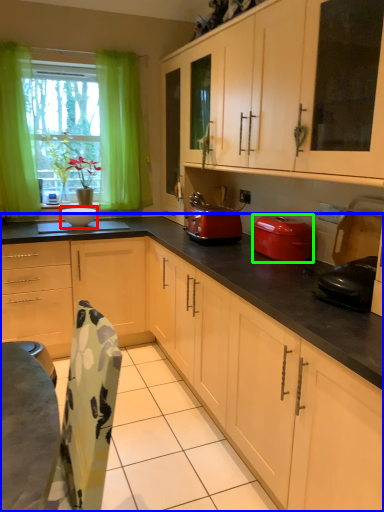
Question: Which is nearer to the appliance (highlighted by a red box)? cabinetry (highlighted by a blue box) or kitchen appliance (highlighted by a green box).

Choices:
 (A) cabinetry
 (B) kitchen appliance

Answer: (B)